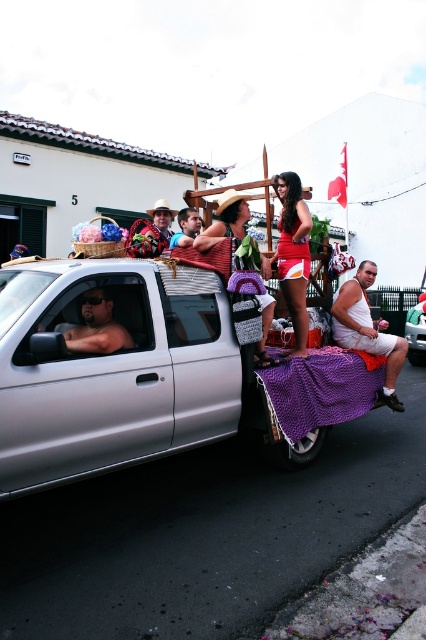
What do you see at coordinates (368, 330) in the screenshot? I see `white cotton tank top at right` at bounding box center [368, 330].

Measure the distance between white cotton tank top at right and camera.

5.45 meters

Is point (365, 288) more distant than point (414, 312)?

No, (365, 288) is closer to viewer.

Find the location of a particular element. Image resolution: width=426 pixels, height=640 pixels. white cotton tank top at right is located at coordinates (368, 330).

Is shiny red shorts at center wider than matte brown hat at upper center?

Correct, the width of shiny red shorts at center exceeds that of matte brown hat at upper center.

Is the position of shiny red shorts at center more distant than that of matte brown hat at upper center?

No, it is in front of matte brown hat at upper center.

Is point (298, 289) more distant than point (167, 214)?

No, it is in front of (167, 214).

Where is `shiny red shorts at center`? This screenshot has width=426, height=640. shiny red shorts at center is located at coordinates click(x=293, y=253).

Which of these two, smooth tan skin at center or matte brown hat at upper center, stands taller?

smooth tan skin at center is taller.

Who is more distant from viewer, (115, 326) or (154, 220)?

Positioned behind is point (154, 220).

Does point (92, 292) come closer to viewer compared to point (152, 209)?

Yes, it is in front of point (152, 209).

Where is `smooth tan skin at center`? This screenshot has height=640, width=426. smooth tan skin at center is located at coordinates (97, 326).